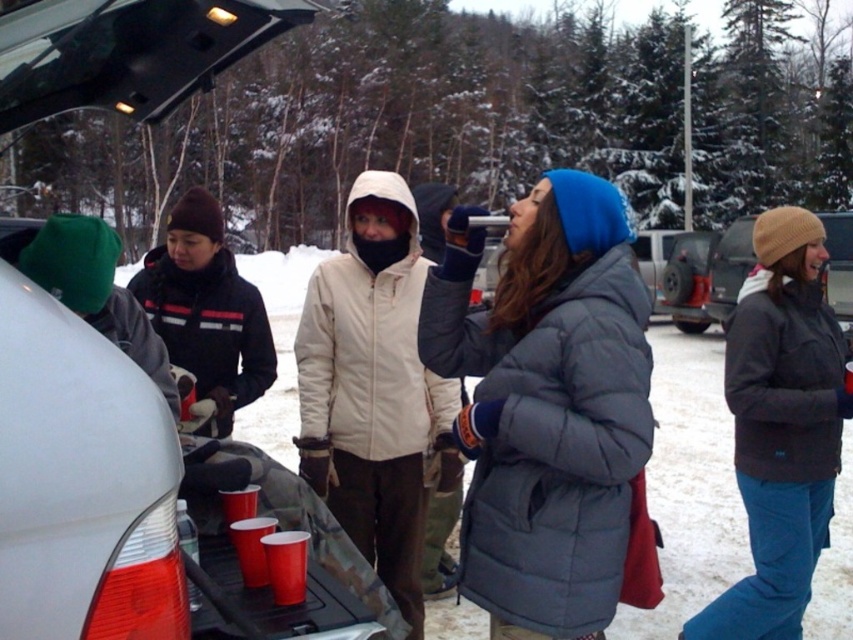
You are organizing a winter picnic and need to store a shiny plastic cup at lower center in your matte white jacket at center. Is there enough space to fit the cup inside the jacket?

The matte white jacket at center is larger in size than the shiny plastic cup at lower center, so yes, the cup can fit inside the jacket.

You are standing at the position of point (x=273, y=528) and want to walk towards the white vehicle with its trunk open. Is the point (x=302, y=563) between you and the vehicle?

Yes, the point (x=302, y=563) is between you and the vehicle because it is in front of point (x=273, y=528), which is your current position.